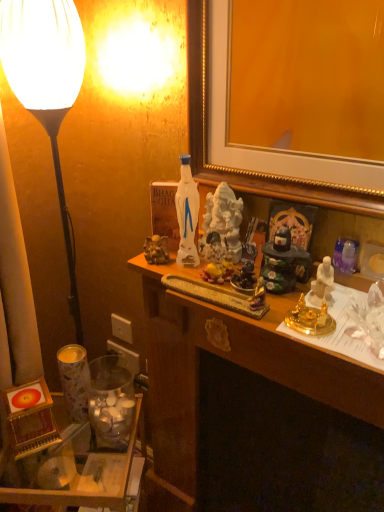
Question: Is white matte lamp at left closer to the viewer compared to translucent glass jar at lower left?

Choices:
 (A) yes
 (B) no

Answer: (A)

Question: From the image's perspective, is white matte lamp at left beneath translucent glass jar at lower left?

Choices:
 (A) no
 (B) yes

Answer: (A)

Question: Is white matte lamp at left positioned with its back to translucent glass jar at lower left?

Choices:
 (A) yes
 (B) no

Answer: (B)

Question: Considering the relative sizes of white matte lamp at left and translucent glass jar at lower left in the image provided, is white matte lamp at left shorter than translucent glass jar at lower left?

Choices:
 (A) yes
 (B) no

Answer: (B)

Question: Does white matte lamp at left have a larger size compared to translucent glass jar at lower left?

Choices:
 (A) no
 (B) yes

Answer: (A)

Question: From their relative heights in the image, would you say translucent glass jar at lower left is taller or shorter than white plastic power outlet at lower left, arranged as the 2th power outlet when viewed from the top?

Choices:
 (A) short
 (B) tall

Answer: (B)

Question: Is translucent glass jar at lower left situated inside white plastic power outlet at lower left, arranged as the 2th power outlet when viewed from the top, or outside?

Choices:
 (A) outside
 (B) inside

Answer: (A)

Question: Is translucent glass jar at lower left bigger or smaller than white plastic power outlet at lower left, arranged as the 2th power outlet when viewed from the top?

Choices:
 (A) big
 (B) small

Answer: (A)

Question: From a real-world perspective, is translucent glass jar at lower left above or below white plastic power outlet at lower left, the first power outlet positioned from the bottom?

Choices:
 (A) below
 (B) above

Answer: (A)

Question: Would you say white plastic power outlet at lower left, the first power outlet positioned from the bottom, is to the left or to the right of translucent glass jar at lower left in the picture?

Choices:
 (A) left
 (B) right

Answer: (A)

Question: Looking at the image, does white plastic power outlet at lower left, arranged as the 2th power outlet when viewed from the top, seem bigger or smaller compared to translucent glass jar at lower left?

Choices:
 (A) big
 (B) small

Answer: (B)

Question: In terms of width, does white plastic power outlet at lower left, arranged as the 2th power outlet when viewed from the top, look wider or thinner when compared to translucent glass jar at lower left?

Choices:
 (A) thin
 (B) wide

Answer: (A)

Question: Which is correct: white plastic power outlet at lower left, arranged as the 2th power outlet when viewed from the top, is inside translucent glass jar at lower left, or outside of it?

Choices:
 (A) outside
 (B) inside

Answer: (A)

Question: Considering the positions of white plastic power outlet at lower left, the first power outlet positioned from the bottom, and wooden desk at center in the image, is white plastic power outlet at lower left, the first power outlet positioned from the bottom, bigger or smaller than wooden desk at center?

Choices:
 (A) big
 (B) small

Answer: (B)

Question: Is white plastic power outlet at lower left, the first power outlet positioned from the bottom, to the left or to the right of wooden desk at center in the image?

Choices:
 (A) left
 (B) right

Answer: (A)